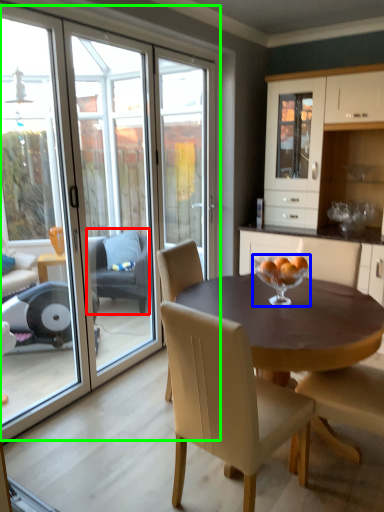
Question: Which object is positioned closest to chair (highlighted by a red box)? Select from glass bowl (highlighted by a blue box) and glass door (highlighted by a green box).

Choices:
 (A) glass bowl
 (B) glass door

Answer: (B)